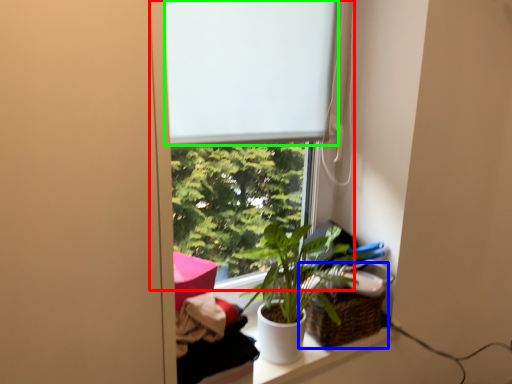
Question: Which object is positioned closest to window (highlighted by a red box)? Select from basket (highlighted by a blue box) and window screen (highlighted by a green box).

Choices:
 (A) basket
 (B) window screen

Answer: (B)